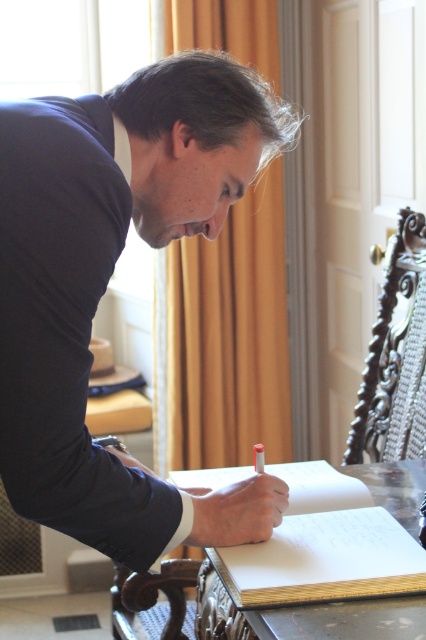
Question: Does dark blue shirt at center appear over wooden table at center?

Choices:
 (A) no
 (B) yes

Answer: (B)

Question: Can you confirm if dark blue shirt at center is positioned to the right of wooden table at center?

Choices:
 (A) no
 (B) yes

Answer: (A)

Question: Can you confirm if dark blue shirt at center is bigger than wooden table at center?

Choices:
 (A) yes
 (B) no

Answer: (A)